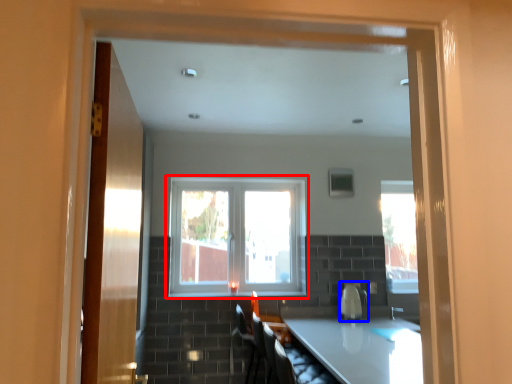
Question: Which object appears closest to the camera in this image, window (highlighted by a red box) or appliance (highlighted by a blue box)?

Choices:
 (A) window
 (B) appliance

Answer: (B)